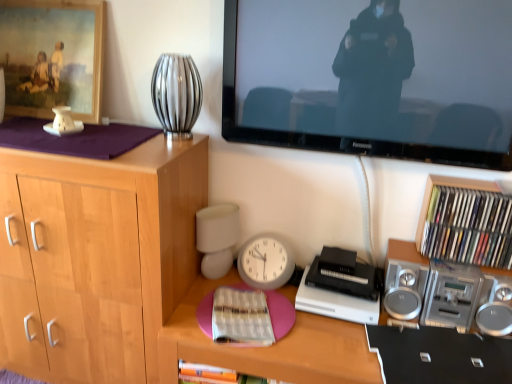
Locate an element on the screen. The height and width of the screenshot is (384, 512). vacant area on top of silver metallic stereo at right (from a real-world perspective) is located at coordinates (442, 264).